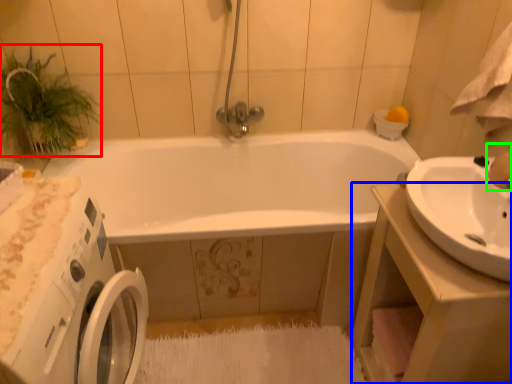
Question: Which object is the closest to the plant (highlighted by a red box)? Choose among these: counter top (highlighted by a blue box) or faucet (highlighted by a green box).

Choices:
 (A) counter top
 (B) faucet

Answer: (A)